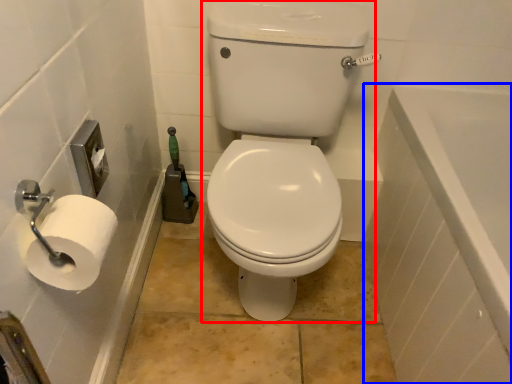
Question: Which point is closer to the camera, sit (highlighted by a red box) or bath (highlighted by a blue box)?

Choices:
 (A) sit
 (B) bath

Answer: (B)